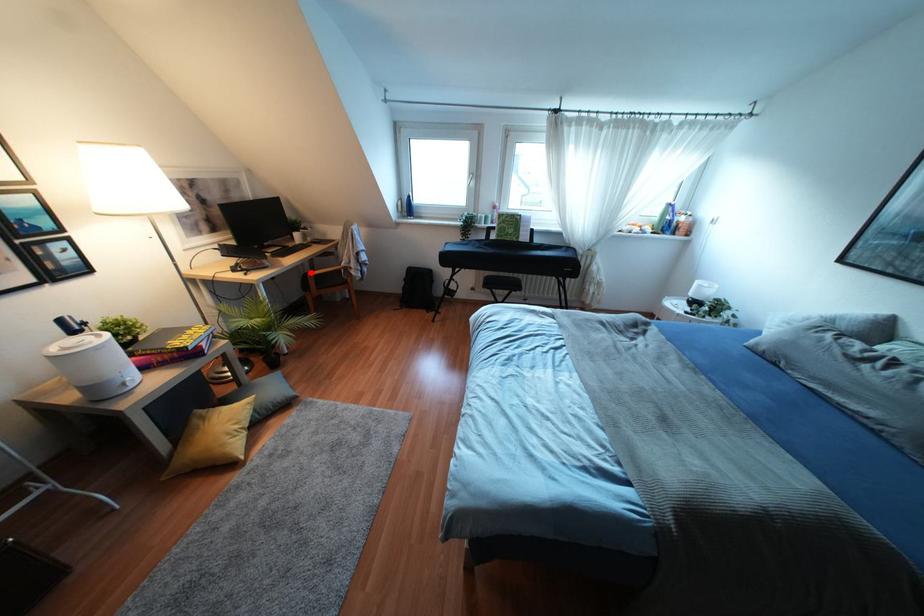
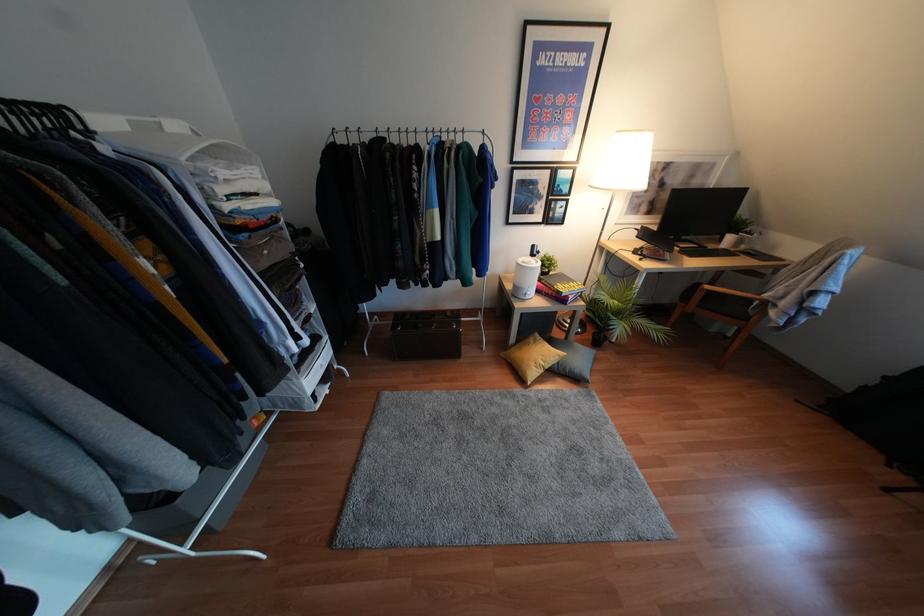
Question: I am providing you with two images of the same scene from different viewpoints. A red point is shown in image1. For the corresponding object point in image2, is it positioned nearer or farther from the camera?

Choices:
 (A) Nearer
 (B) Farther

Answer: (A)